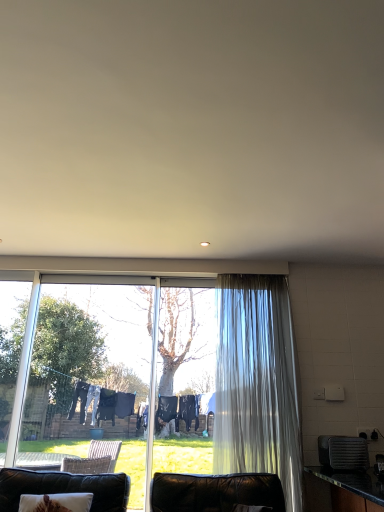
Question: Can you confirm if black plastic toaster at right is bigger than translucent fabric curtain at right?

Choices:
 (A) yes
 (B) no

Answer: (B)

Question: Considering the relative sizes of black plastic toaster at right and translucent fabric curtain at right in the image provided, is black plastic toaster at right wider than translucent fabric curtain at right?

Choices:
 (A) no
 (B) yes

Answer: (B)

Question: Are black plastic toaster at right and translucent fabric curtain at right beside each other?

Choices:
 (A) no
 (B) yes

Answer: (A)

Question: From the image's perspective, is black plastic toaster at right located above translucent fabric curtain at right?

Choices:
 (A) no
 (B) yes

Answer: (A)

Question: Is the position of black plastic toaster at right more distant than that of translucent fabric curtain at right?

Choices:
 (A) yes
 (B) no

Answer: (B)

Question: From the image's perspective, is leather couch at lower left above or below translucent fabric curtain at right?

Choices:
 (A) above
 (B) below

Answer: (B)

Question: Is leather couch at lower left in front of or behind translucent fabric curtain at right in the image?

Choices:
 (A) front
 (B) behind

Answer: (A)

Question: Looking at the image, does leather couch at lower left seem bigger or smaller compared to translucent fabric curtain at right?

Choices:
 (A) big
 (B) small

Answer: (A)

Question: From a real-world perspective, relative to translucent fabric curtain at right, is leather couch at lower left vertically above or below?

Choices:
 (A) below
 (B) above

Answer: (A)

Question: Relative to translucent fabric curtain at right, is black plastic toaster at right in front or behind?

Choices:
 (A) front
 (B) behind

Answer: (A)

Question: From a real-world perspective, relative to translucent fabric curtain at right, is black plastic toaster at right vertically above or below?

Choices:
 (A) below
 (B) above

Answer: (A)

Question: Is black plastic toaster at right bigger or smaller than translucent fabric curtain at right?

Choices:
 (A) big
 (B) small

Answer: (B)

Question: Is black plastic toaster at right inside or outside of translucent fabric curtain at right?

Choices:
 (A) inside
 (B) outside

Answer: (B)

Question: Would you say translucent fabric curtain at right is to the left or to the right of leather couch at lower left in the picture?

Choices:
 (A) left
 (B) right

Answer: (B)

Question: From the image's perspective, is translucent fabric curtain at right located above or below leather couch at lower left?

Choices:
 (A) below
 (B) above

Answer: (B)